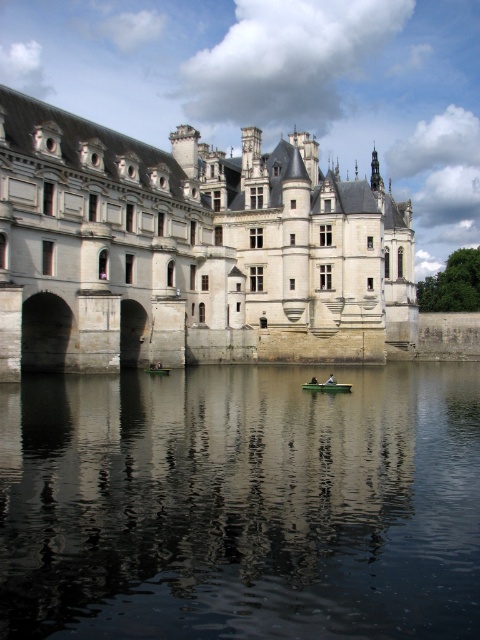
Question: Can you confirm if dark reflective water at center is bigger than white stone castle at center?

Choices:
 (A) no
 (B) yes

Answer: (A)

Question: Where is white stone castle at center located in relation to green fabric boat at center in the image?

Choices:
 (A) left
 (B) right

Answer: (B)

Question: Estimate the real-world distances between objects in this image. Which object is closer to the green fabric boat at center?

Choices:
 (A) dark reflective water at center
 (B) white stone castle at center
 (C) green plastic boat at center

Answer: (C)

Question: Which object appears farthest from the camera in this image?

Choices:
 (A) green fabric boat at center
 (B) white stone castle at center
 (C) green plastic boat at center

Answer: (A)

Question: Which object appears closest to the camera in this image?

Choices:
 (A) green fabric boat at center
 (B) green plastic boat at center
 (C) dark reflective water at center

Answer: (C)

Question: Is green plastic boat at center positioned behind green fabric boat at center?

Choices:
 (A) yes
 (B) no

Answer: (B)